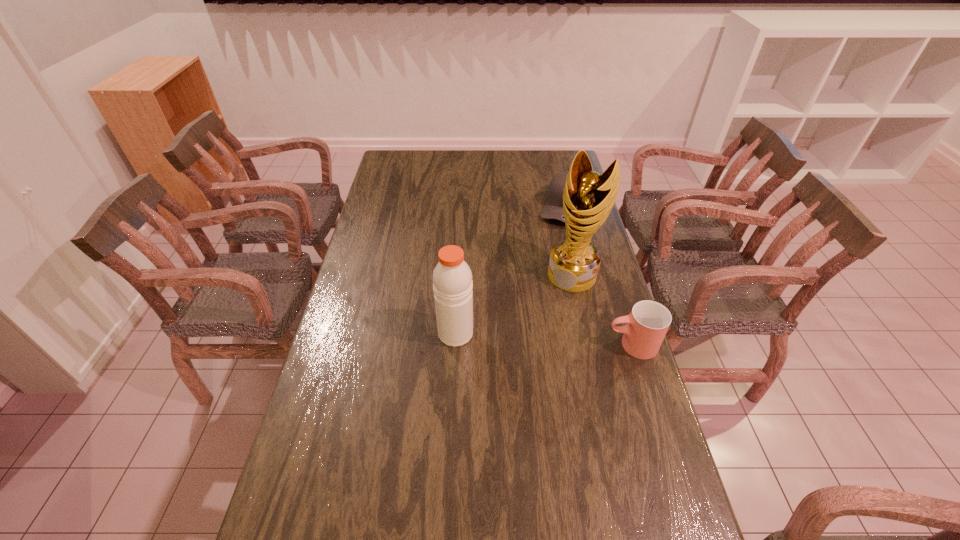
Image resolution: width=960 pixels, height=540 pixels. I want to click on vacant region located 0.370m on the front-facing side of the award, so [509, 367].

The width and height of the screenshot is (960, 540). In order to click on vacant area situated 0.150m on the front-facing side of the award in this screenshot , I will do (x=542, y=318).

Identify the location of vacant space situated 0.280m on the front-facing side of the award. (523, 346).

Find the location of a particular element. The width and height of the screenshot is (960, 540). vacant space positioned on the front brim of the baseball cap is located at coordinates (553, 247).

This screenshot has height=540, width=960. Find the location of `free space located on the front brim of the baseball cap`. free space located on the front brim of the baseball cap is located at coordinates (550, 256).

This screenshot has height=540, width=960. Find the location of `vacant space located 0.190m on the front brim of the baseball cap`. vacant space located 0.190m on the front brim of the baseball cap is located at coordinates (550, 256).

Identify the location of cup that is at the right edge. This screenshot has width=960, height=540. (647, 324).

Find the location of a particular element. award present at the right edge is located at coordinates (588, 197).

Locate an element on the screen. baseball cap that is at the right edge is located at coordinates (553, 209).

In the image, there is a desktop. Where is `vacant space at the far edge`? vacant space at the far edge is located at coordinates (450, 174).